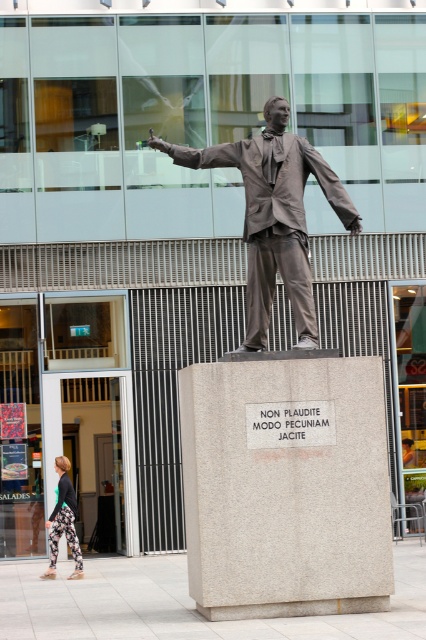
Question: Among these points, which one is nearest to the camera?

Choices:
 (A) (261, 305)
 (B) (62, 461)

Answer: (A)

Question: Is bronze statue at center smaller than floral leggings at lower left?

Choices:
 (A) no
 (B) yes

Answer: (A)

Question: Among these objects, which one is nearest to the camera?

Choices:
 (A) floral leggings at lower left
 (B) bronze statue at center

Answer: (B)

Question: Is bronze statue at center wider than floral leggings at lower left?

Choices:
 (A) yes
 (B) no

Answer: (A)

Question: Which object is closer to the camera taking this photo?

Choices:
 (A) floral leggings at lower left
 (B) bronze statue at center

Answer: (B)

Question: Does bronze statue at center appear on the right side of floral leggings at lower left?

Choices:
 (A) no
 (B) yes

Answer: (B)